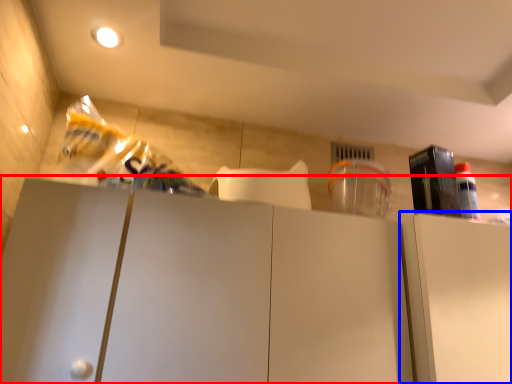
Question: Which object is further to the camera taking this photo, cabinetry (highlighted by a red box) or cabinetry (highlighted by a blue box)?

Choices:
 (A) cabinetry
 (B) cabinetry

Answer: (B)